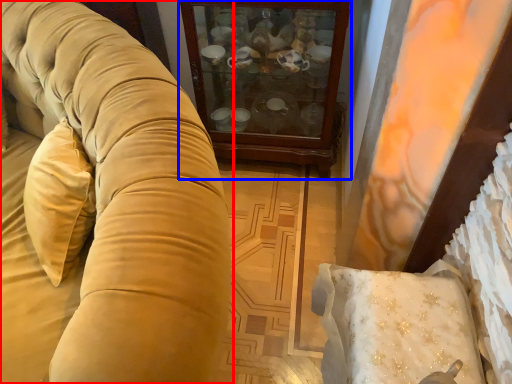
Question: Which of the following is the farthest to the observer, studio couch (highlighted by a red box) or furniture (highlighted by a blue box)?

Choices:
 (A) studio couch
 (B) furniture

Answer: (B)